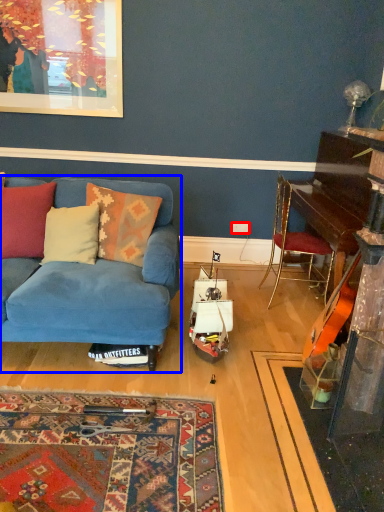
Question: Which point is closer to the camera, power outlet (highlighted by a red box) or studio couch (highlighted by a blue box)?

Choices:
 (A) power outlet
 (B) studio couch

Answer: (B)